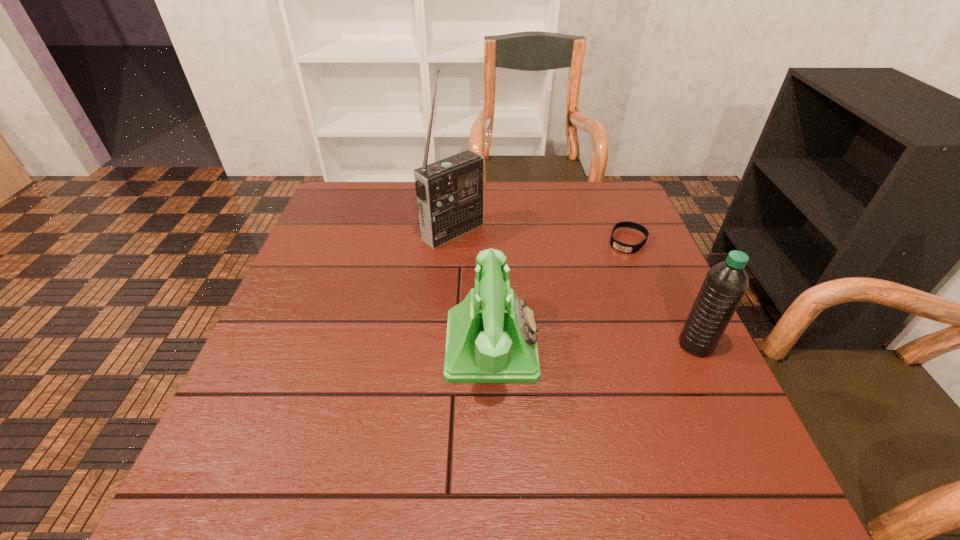
Find the location of `blank space that satisfies the following two spatial constraints: 1. on the front side of the second tallest object; 2. on the left side of the radio receiver`. blank space that satisfies the following two spatial constraints: 1. on the front side of the second tallest object; 2. on the left side of the radio receiver is located at coordinates (444, 345).